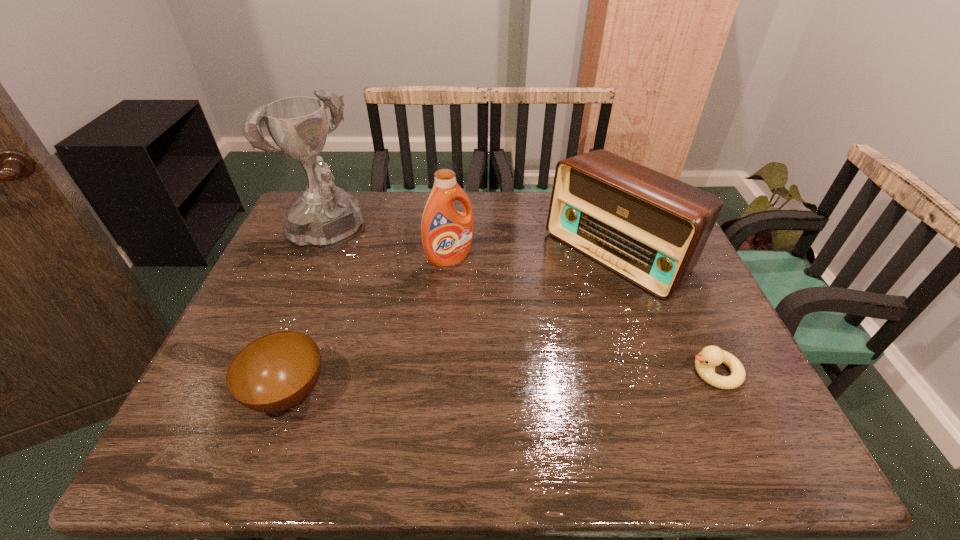
Find the location of a particular element. This screenshot has height=540, width=960. vacant area that lies between the second tallest object and the bowl is located at coordinates (369, 326).

Image resolution: width=960 pixels, height=540 pixels. What are the coordinates of `free spot between the third object from left to right and the radio receiver` in the screenshot? It's located at (534, 255).

This screenshot has width=960, height=540. What are the coordinates of `vacant space in between the third tallest object and the second shortest object` in the screenshot? It's located at (453, 322).

Where is `vacant region between the radio receiver and the bowl`? vacant region between the radio receiver and the bowl is located at coordinates pyautogui.click(x=453, y=322).

This screenshot has width=960, height=540. What are the coordinates of `unoccupied area between the shortest object and the tallest object` in the screenshot? It's located at (519, 304).

Locate an element on the screen. This screenshot has width=960, height=540. vacant space in between the radio receiver and the award is located at coordinates (471, 244).

Where is `object that ranks as the fourth closest to the second shortest object`? The height and width of the screenshot is (540, 960). object that ranks as the fourth closest to the second shortest object is located at coordinates (710, 356).

You are a GUI agent. You are given a task and a screenshot of the screen. Output one action in this format:
    pyautogui.click(x=<x>, y=<y>)
    Task: Click on the closest object to the shortest object
    The height and width of the screenshot is (540, 960).
    Given the screenshot: What is the action you would take?
    pyautogui.click(x=649, y=228)

The width and height of the screenshot is (960, 540). I want to click on vacant space that satisfies the following two spatial constraints: 1. on the front side of the award; 2. on the left side of the detergent, so click(315, 258).

Where is `vacant area that satisfies the following two spatial constraints: 1. on the back side of the second shortest object; 2. on the left side of the fourth shortest object`? Image resolution: width=960 pixels, height=540 pixels. vacant area that satisfies the following two spatial constraints: 1. on the back side of the second shortest object; 2. on the left side of the fourth shortest object is located at coordinates coord(337,258).